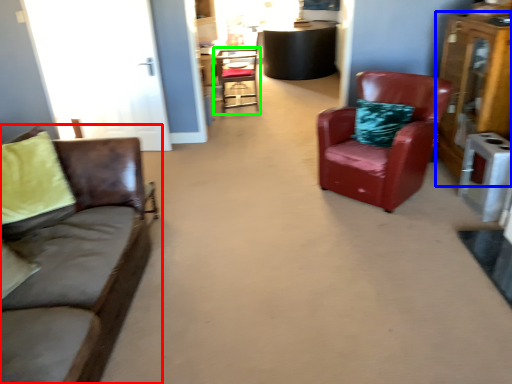
Question: Which is nearer to the studio couch (highlighted by a red box)? dresser (highlighted by a blue box) or chair (highlighted by a green box).

Choices:
 (A) dresser
 (B) chair

Answer: (A)